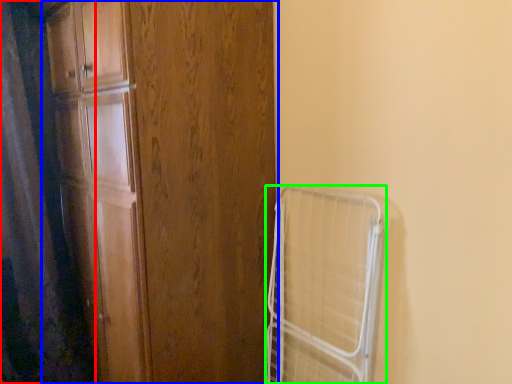
Question: Which object is positioned closest to shower curtain (highlighted by a red box)? Select from door (highlighted by a blue box) and cage (highlighted by a green box).

Choices:
 (A) door
 (B) cage

Answer: (A)